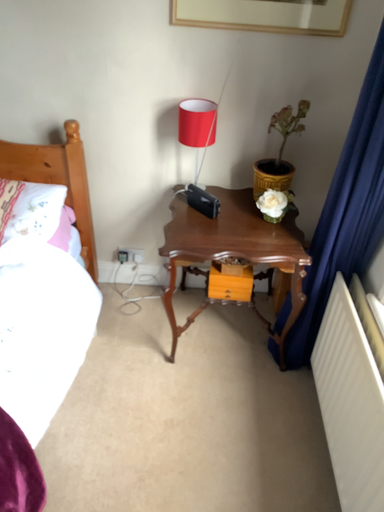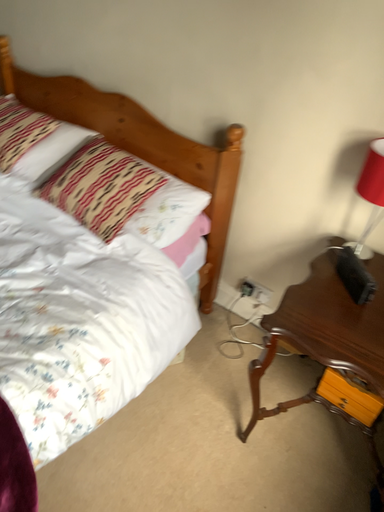
Question: Which way did the camera rotate in the video?

Choices:
 (A) rotated right
 (B) rotated left

Answer: (B)